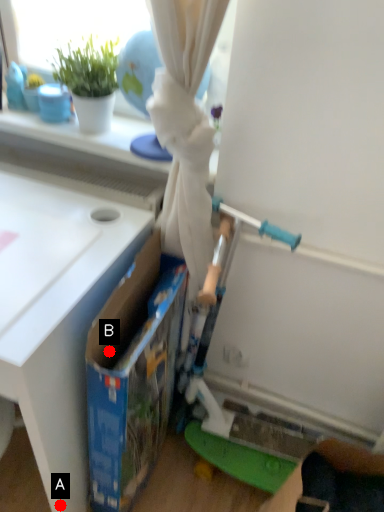
Question: Two points are circled on the image, labeled by A and B beside each circle. Which point is farther from the camera taking this photo?

Choices:
 (A) A is further
 (B) B is further

Answer: (A)